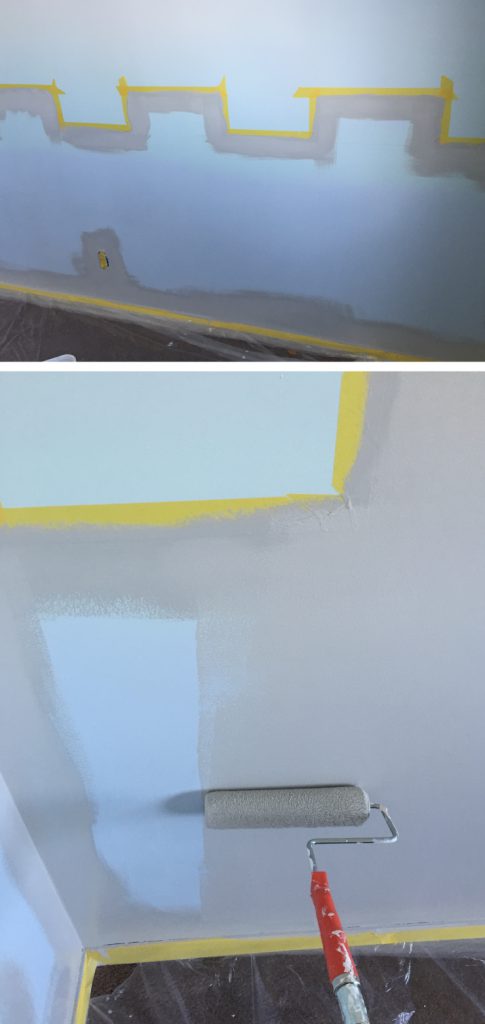
At what (x,y) coordinates should I click in order to perform the action: click on fuzzy end of the paint roller that holds the paint. Please return your answer as a coordinate pair (x, y). The image size is (485, 1024). Looking at the image, I should click on (276, 808).